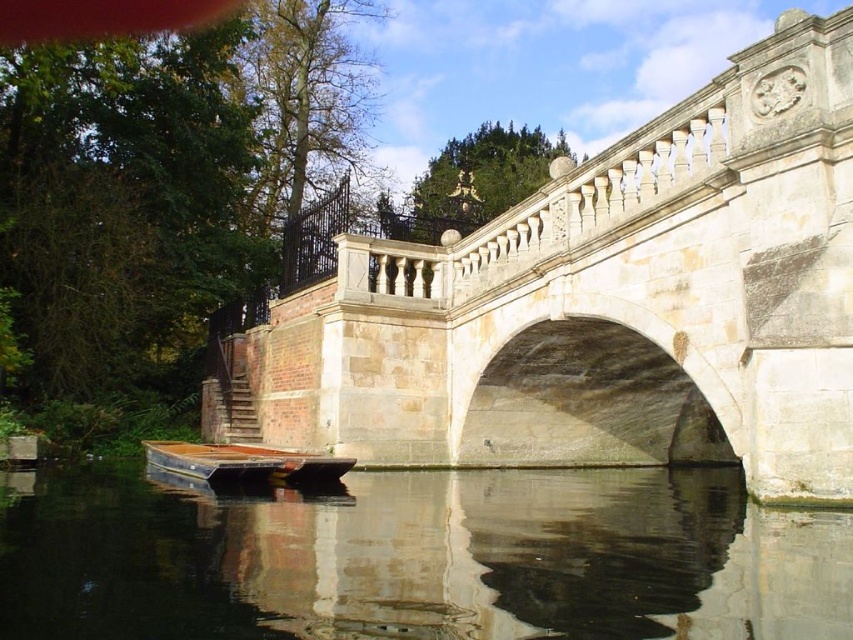
Is smooth dark water at center further to the viewer compared to wooden dock at lower center?

No, it is not.

Measure the distance between point (416, 513) and camera.

Point (416, 513) is 43.48 meters away from camera.

Image resolution: width=853 pixels, height=640 pixels. I want to click on smooth dark water at center, so click(419, 557).

Can you confirm if stone bridge at center is smaller than wooden dock at lower center?

No, stone bridge at center is not smaller than wooden dock at lower center.

Does stone bridge at center have a larger size compared to wooden dock at lower center?

Yes.

At what (x,y) coordinates should I click in order to perform the action: click on stone bridge at center. Please return your answer as a coordinate pair (x, y). Looking at the image, I should click on (598, 305).

You are a GUI agent. You are given a task and a screenshot of the screen. Output one action in this format:
    pyautogui.click(x=<x>, y=<y>)
    Task: Click on the stone bridge at center
    The image size is (853, 640).
    Given the screenshot: What is the action you would take?
    pyautogui.click(x=598, y=305)

Who is positioned more to the left, stone bridge at center or smooth dark water at center?

From the viewer's perspective, smooth dark water at center appears more on the left side.

Is stone bridge at center closer to camera compared to smooth dark water at center?

No, it is not.

What do you see at coordinates (598, 305) in the screenshot? I see `stone bridge at center` at bounding box center [598, 305].

What are the coordinates of `stone bridge at center` in the screenshot? It's located at (598, 305).